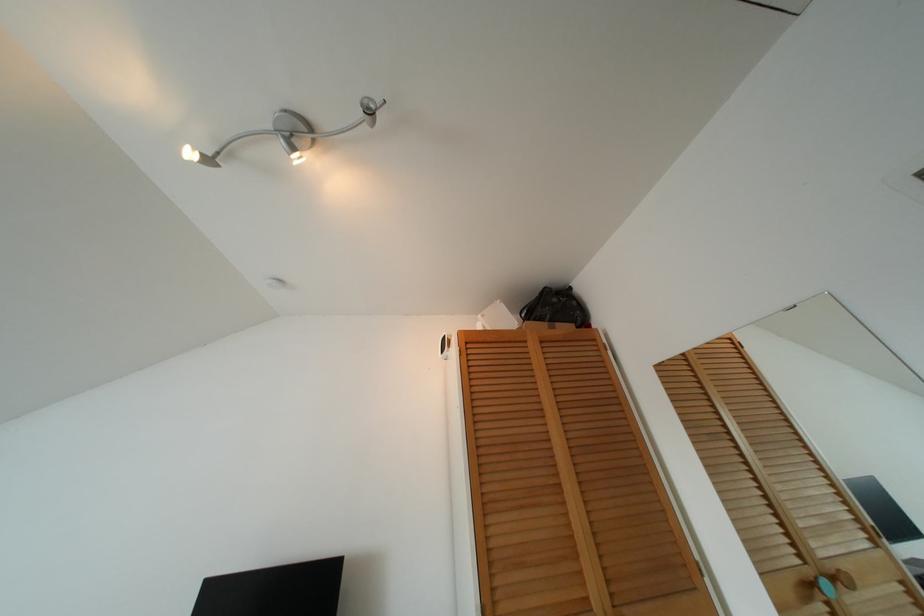
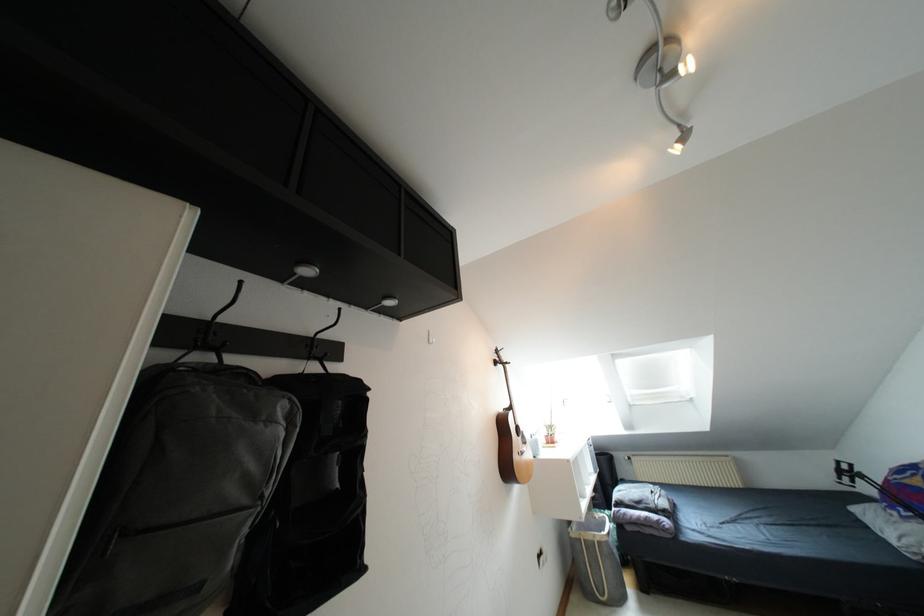
Find the pixel in the second image that matches (x=208, y=160) in the first image.

(683, 138)